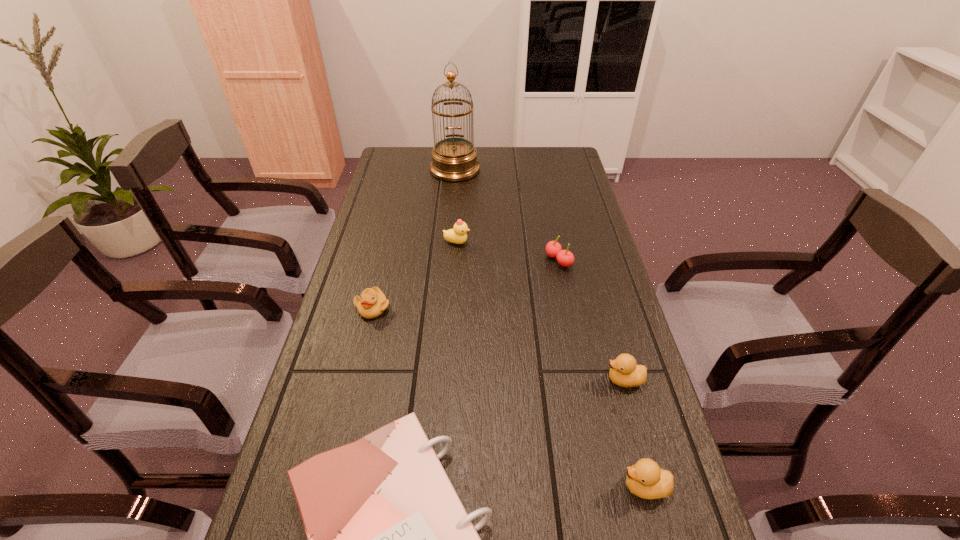
The image size is (960, 540). I want to click on object at the left edge, so click(372, 303).

Identify the location of cherry that is at the right edge. This screenshot has height=540, width=960. (565, 258).

Find the location of a particular element. Image resolution: width=960 pixels, height=540 pixels. free space at the far edge of the desktop is located at coordinates (516, 162).

Where is `free spot at the left edge of the desktop`? The height and width of the screenshot is (540, 960). free spot at the left edge of the desktop is located at coordinates (348, 271).

Find the location of a particular element. Image resolution: width=960 pixels, height=540 pixels. vacant space at the right edge is located at coordinates (562, 198).

Find the location of a particular element. This screenshot has width=960, height=540. free space between the fifth nearest object and the second farthest duckling is located at coordinates (466, 284).

Locate an element on the screen. free space between the leftmost duckling and the farthest object is located at coordinates (414, 239).

Where is `vacant space in between the birdcage and the leftmost duckling`? This screenshot has height=540, width=960. vacant space in between the birdcage and the leftmost duckling is located at coordinates (414, 239).

Where is `free space between the birdcage and the second duckling from left to right`? The width and height of the screenshot is (960, 540). free space between the birdcage and the second duckling from left to right is located at coordinates (456, 206).

The width and height of the screenshot is (960, 540). I want to click on free space between the second nearest duckling and the nearest duckling, so click(635, 433).